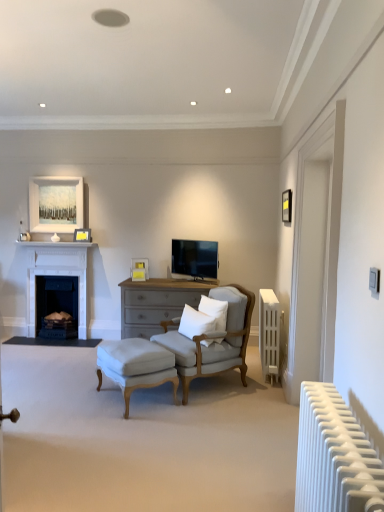
Question: Is white soft pillow at center, the first pillow positioned from the right, oriented towards matte black picture frame at upper right, marked as the first picture frame in a front-to-back arrangement?

Choices:
 (A) no
 (B) yes

Answer: (A)

Question: From the image's perspective, is white soft pillow at center, the first pillow positioned from the right, beneath matte black picture frame at upper right, the 3th picture frame from the left?

Choices:
 (A) yes
 (B) no

Answer: (A)

Question: Is white soft pillow at center, the first pillow positioned from the right, closer to the viewer compared to matte black picture frame at upper right, the first picture frame in the top-to-bottom sequence?

Choices:
 (A) yes
 (B) no

Answer: (A)

Question: Would you say matte black picture frame at upper right, the third picture frame positioned from the bottom, is part of white soft pillow at center, the second pillow when ordered from left to right,'s contents?

Choices:
 (A) no
 (B) yes

Answer: (A)

Question: Is white soft pillow at center, the first pillow positioned from the right, shorter than matte black picture frame at upper right, the 3th picture frame from the left?

Choices:
 (A) no
 (B) yes

Answer: (A)

Question: Considering the positions of white cotton pillow at center, the first pillow viewed from the left, and white matte radiator at right, placed as the 1th radiator when sorted from left to right, in the image, is white cotton pillow at center, the first pillow viewed from the left, taller or shorter than white matte radiator at right, placed as the 1th radiator when sorted from left to right,?

Choices:
 (A) short
 (B) tall

Answer: (A)

Question: From a real-world perspective, is white cotton pillow at center, the first pillow viewed from the left, physically located above or below white matte radiator at right, the second radiator in the right-to-left sequence?

Choices:
 (A) above
 (B) below

Answer: (A)

Question: Looking at their shapes, would you say white cotton pillow at center, the 2th pillow in the right-to-left sequence, is wider or thinner than white matte radiator at right, placed as the 1th radiator when sorted from left to right?

Choices:
 (A) thin
 (B) wide

Answer: (B)

Question: From the image's perspective, is white cotton pillow at center, the first pillow viewed from the left, positioned above or below white matte radiator at right, the 2th radiator from the back?

Choices:
 (A) above
 (B) below

Answer: (A)

Question: In terms of height, does white cotton pillow at center, the 2th pillow in the right-to-left sequence, look taller or shorter compared to matte white picture frame at center, the second picture frame when ordered from right to left?

Choices:
 (A) short
 (B) tall

Answer: (B)

Question: From a real-world perspective, is white cotton pillow at center, the 2th pillow in the right-to-left sequence, above or below matte white picture frame at center, the 3th picture frame positioned from the top?

Choices:
 (A) above
 (B) below

Answer: (B)

Question: Relative to matte white picture frame at center, which is counted as the second picture frame, starting from the front, is white cotton pillow at center, the 2th pillow in the right-to-left sequence, in front or behind?

Choices:
 (A) behind
 (B) front

Answer: (B)

Question: From the image's perspective, is white cotton pillow at center, the first pillow viewed from the left, located above or below matte white picture frame at center, the first picture frame from the bottom?

Choices:
 (A) above
 (B) below

Answer: (B)

Question: In terms of height, does white matte picture frame at upper left, the 3th picture frame when ordered from right to left, look taller or shorter compared to light gray fabric armchair at center?

Choices:
 (A) short
 (B) tall

Answer: (A)

Question: From a real-world perspective, is white matte picture frame at upper left, the 2th picture frame from the top, positioned above or below light gray fabric armchair at center?

Choices:
 (A) above
 (B) below

Answer: (A)